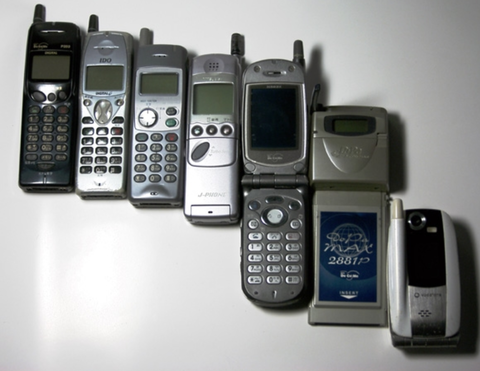
This screenshot has height=371, width=480. In order to click on phones in this screenshot , I will do `click(70, 71)`, `click(108, 85)`, `click(155, 86)`, `click(213, 107)`, `click(337, 176)`, `click(270, 138)`, `click(416, 243)`.